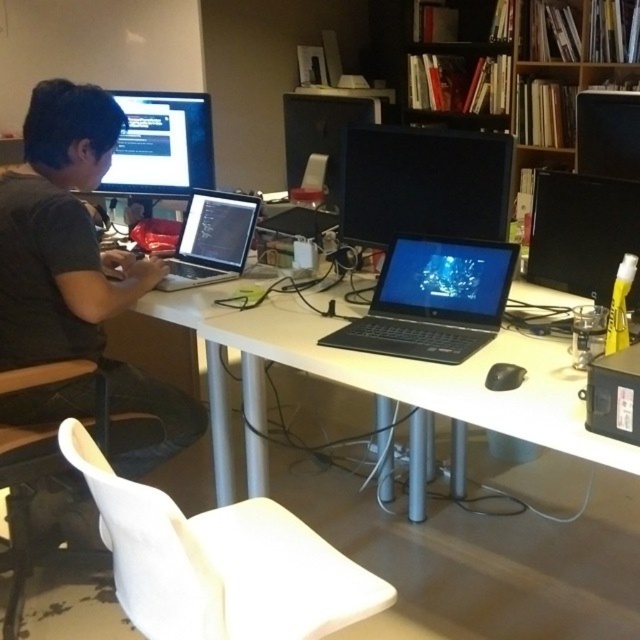
Is white plastic chair at lower left wider than wooden bookshelf at upper center?

No.

Does white plastic chair at lower left appear on the left side of wooden bookshelf at upper center?

Correct, you'll find white plastic chair at lower left to the left of wooden bookshelf at upper center.

What do you see at coordinates (220, 563) in the screenshot? The width and height of the screenshot is (640, 640). I see `white plastic chair at lower left` at bounding box center [220, 563].

Where is `white plastic chair at lower left`? Image resolution: width=640 pixels, height=640 pixels. white plastic chair at lower left is located at coordinates (220, 563).

Is white plastic desk at center shorter than white plastic chair at lower left?

Incorrect, white plastic desk at center's height does not fall short of white plastic chair at lower left's.

Is white plastic desk at center to the left of white plastic chair at lower left from the viewer's perspective?

Incorrect, white plastic desk at center is not on the left side of white plastic chair at lower left.

Find the location of a particular element. This screenshot has height=640, width=640. white plastic desk at center is located at coordinates (385, 381).

Does black glossy monitor at center have a lesser height compared to matte black monitor at right?

In fact, black glossy monitor at center may be taller than matte black monitor at right.

Which is more to the right, black glossy monitor at center or matte black monitor at right?

From the viewer's perspective, matte black monitor at right appears more on the right side.

Describe the element at coordinates (422, 182) in the screenshot. I see `black glossy monitor at center` at that location.

What are the coordinates of `black glossy monitor at center` in the screenshot? It's located at (422, 182).